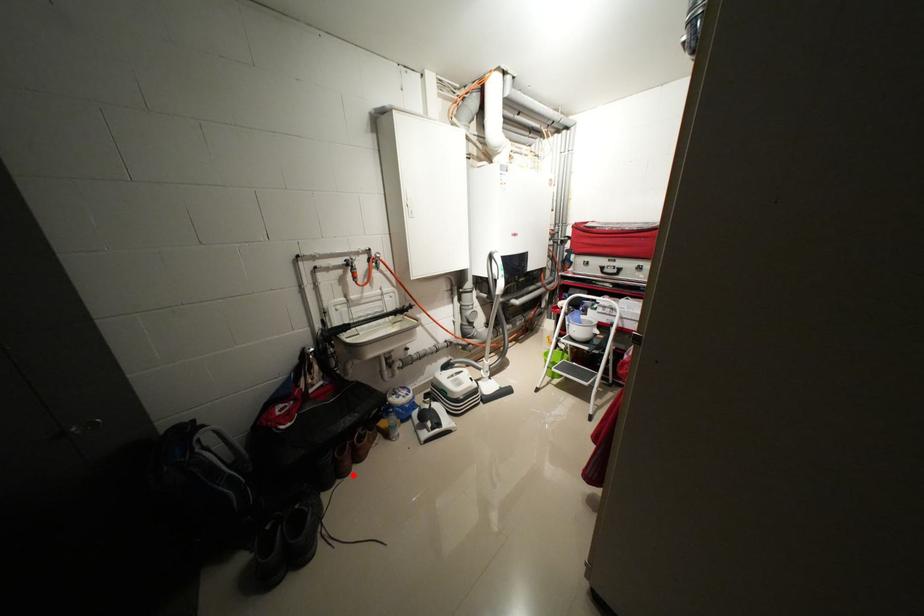
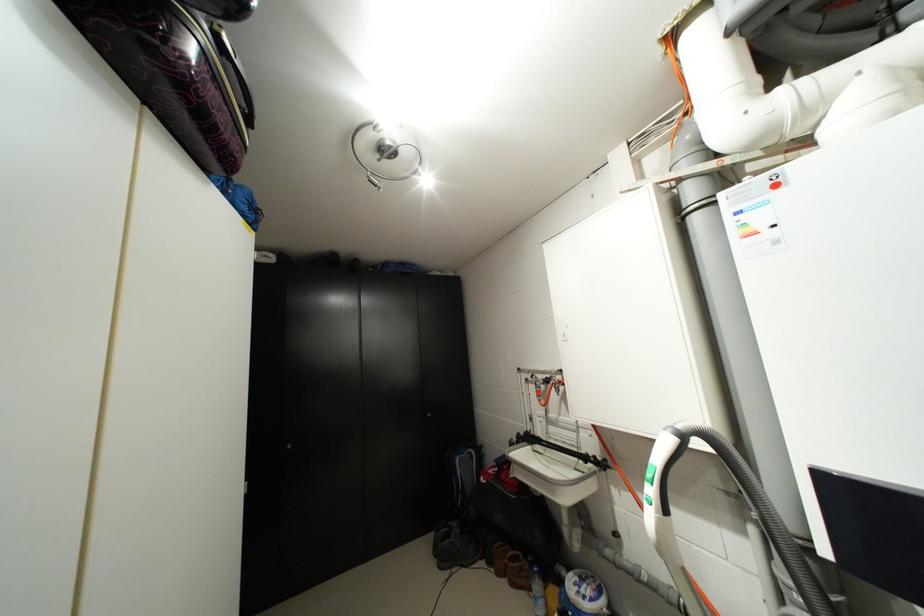
Locate, in the second image, the point that corresponds to the highlighted location in the first image.

(505, 575)